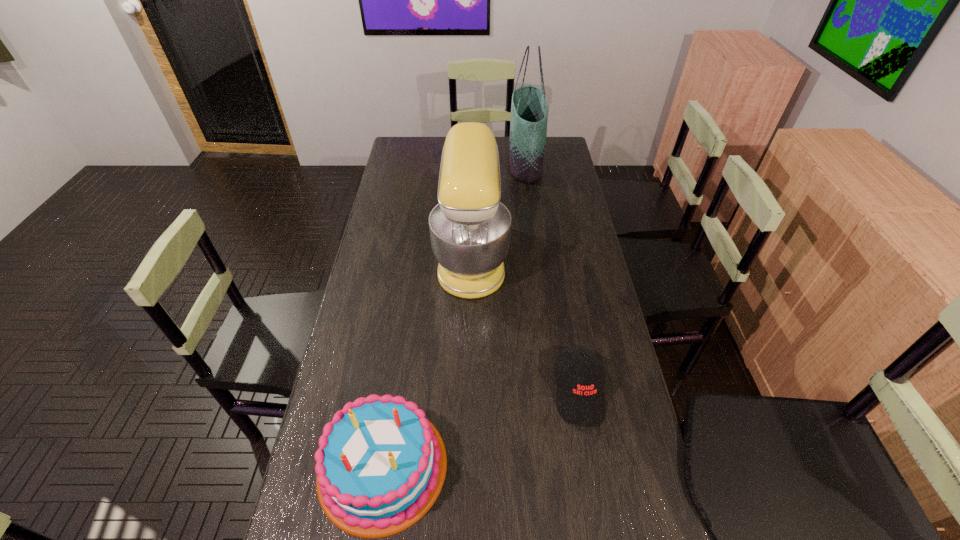
Identify the location of the tallest object. The height and width of the screenshot is (540, 960). (529, 109).

Locate an element on the screen. The width and height of the screenshot is (960, 540). the farthest object is located at coordinates (529, 109).

Image resolution: width=960 pixels, height=540 pixels. Find the location of `the second tallest object`. the second tallest object is located at coordinates (470, 228).

Find the location of a particular element. Image resolution: width=960 pixels, height=540 pixels. the second farthest object is located at coordinates point(470,228).

Where is `the second shortest object`? This screenshot has width=960, height=540. the second shortest object is located at coordinates (380, 465).

At what (x,y) coordinates should I click in order to perform the action: click on the shortest object. Please return your answer as a coordinate pair (x, y). The height and width of the screenshot is (540, 960). Looking at the image, I should click on (580, 397).

Locate an element on the screen. The image size is (960, 540). vacant space located 0.240m on the left of the tote bag is located at coordinates point(456,163).

Where is `free region located 0.130m on the side of the mixer with the control knob`? The image size is (960, 540). free region located 0.130m on the side of the mixer with the control knob is located at coordinates (543, 256).

You are a GUI agent. You are given a task and a screenshot of the screen. Output one action in this format:
    pyautogui.click(x=<x>, y=<y>)
    Task: Click on the vacant space situated 0.160m on the right of the birthday cake
    The height and width of the screenshot is (540, 960).
    Given the screenshot: What is the action you would take?
    pyautogui.click(x=514, y=466)

Find the location of a particular element. The height and width of the screenshot is (540, 960). vacant space located on the front-facing side of the baseball cap is located at coordinates (599, 503).